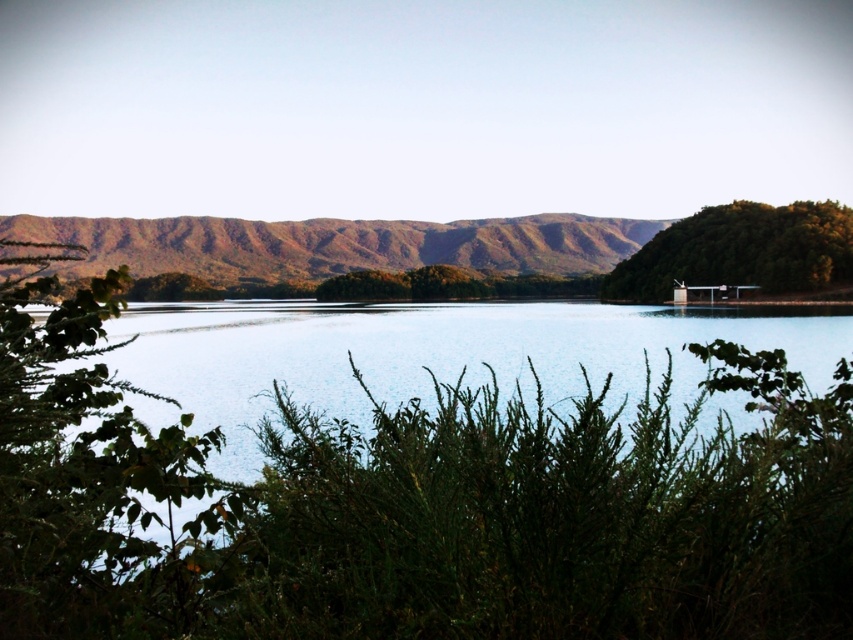
Based on the photo, you are a gardener planning to plant a new flower bed between the green leafy bush at left and the green leafy tree at right. Considering their heights, which one would cast more shade on the flower bed during the afternoon?

Answer: The green leafy tree at right is taller than the green leafy bush at left, so it will cast more shade on the flower bed during the afternoon.

You are an outdoor photographer planning to capture a landscape shot of the green leafy bush at left and the brown textured mountain at center. Considering their sizes in the image, which object should you focus on to ensure it takes up more space in your photo?

The brown textured mountain at center should be focused on because it is larger than the green leafy bush at left in the image.